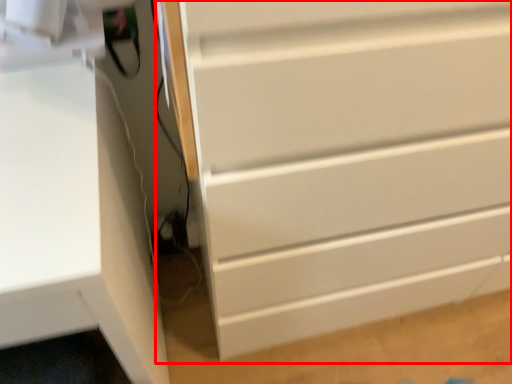
Question: Where is chest of drawers (annotated by the red box) located in relation to computer desk in the image?

Choices:
 (A) right
 (B) left

Answer: (A)